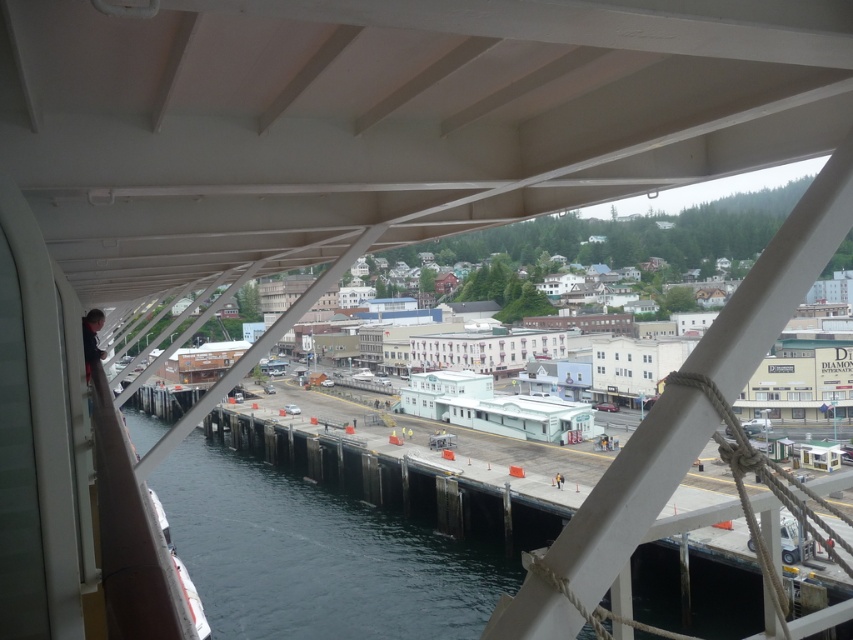
Question: Is dark blue water at lower left to the right of white matte beam at upper right from the viewer's perspective?

Choices:
 (A) yes
 (B) no

Answer: (B)

Question: From the image, what is the correct spatial relationship of dark blue water at lower left in relation to white matte beam at upper right?

Choices:
 (A) left
 (B) right

Answer: (A)

Question: Which of the following is the closest to the observer?

Choices:
 (A) (737, 312)
 (B) (241, 540)

Answer: (A)

Question: Which object is closer to the camera taking this photo?

Choices:
 (A) dark blue water at lower left
 (B) white matte beam at upper right

Answer: (B)

Question: Does dark blue water at lower left appear over white matte beam at upper right?

Choices:
 (A) no
 (B) yes

Answer: (A)